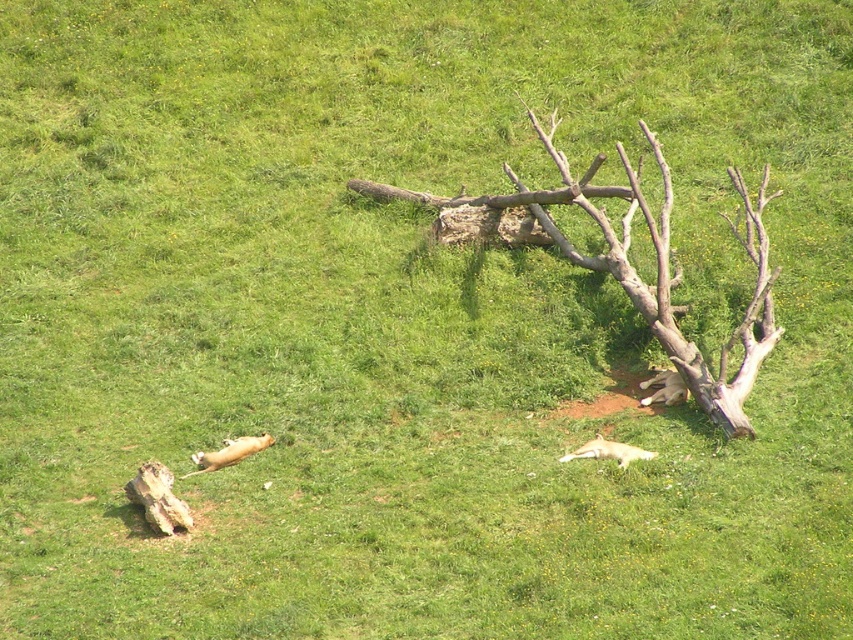
From the picture: Can you confirm if brown rough wood at center is thinner than golden fur fox at lower center?

No, brown rough wood at center is not thinner than golden fur fox at lower center.

Image resolution: width=853 pixels, height=640 pixels. Identify the location of brown rough wood at center. (654, 264).

Who is more forward, (715, 381) or (636, 458)?

Point (636, 458)

Where is `brown rough wood at center`? The width and height of the screenshot is (853, 640). brown rough wood at center is located at coordinates (654, 264).

Does golden fur fox at lower center have a greater height compared to brown fur fox at right?

No.

How distant is golden fur fox at lower center from brown fur fox at right?

golden fur fox at lower center is 36.08 inches from brown fur fox at right.

This screenshot has width=853, height=640. What are the coordinates of `golden fur fox at lower center` in the screenshot? It's located at (608, 451).

Consider the image. Which is more to the left, brown rough wood at center or brown fur fox at right?

brown rough wood at center is more to the left.

Can you confirm if brown rough wood at center is positioned to the right of brown fur fox at right?

In fact, brown rough wood at center is to the left of brown fur fox at right.

The image size is (853, 640). I want to click on brown rough wood at center, so coord(654,264).